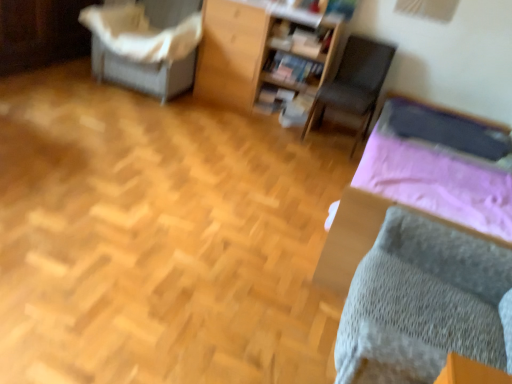
Question: Is white fabric-covered chair at upper left, which is counted as the first furniture, starting from the left, looking in the opposite direction of gray knitted bed at lower right?

Choices:
 (A) no
 (B) yes

Answer: (A)

Question: Considering the relative sizes of white fabric-covered chair at upper left, the 2th furniture in the right-to-left sequence, and gray knitted bed at lower right in the image provided, is white fabric-covered chair at upper left, the 2th furniture in the right-to-left sequence, thinner than gray knitted bed at lower right?

Choices:
 (A) no
 (B) yes

Answer: (B)

Question: Does white fabric-covered chair at upper left, which is counted as the first furniture, starting from the left, contain gray knitted bed at lower right?

Choices:
 (A) yes
 (B) no

Answer: (B)

Question: From a real-world perspective, is white fabric-covered chair at upper left, the 2th furniture in the right-to-left sequence, on gray knitted bed at lower right?

Choices:
 (A) yes
 (B) no

Answer: (A)

Question: Is white fabric-covered chair at upper left, the 2th furniture in the right-to-left sequence, beside gray knitted bed at lower right?

Choices:
 (A) yes
 (B) no

Answer: (B)

Question: Can you confirm if white fabric-covered chair at upper left, the 2th furniture in the right-to-left sequence, is positioned to the right of gray knitted bed at lower right?

Choices:
 (A) no
 (B) yes

Answer: (A)

Question: Is the depth of matte wooden bookshelf at center less than that of wooden bookshelf at upper center, arranged as the second furniture when viewed from the left?

Choices:
 (A) no
 (B) yes

Answer: (A)

Question: Is matte wooden bookshelf at center with wooden bookshelf at upper center, arranged as the second furniture when viewed from the left?

Choices:
 (A) yes
 (B) no

Answer: (B)

Question: Can you confirm if matte wooden bookshelf at center is bigger than wooden bookshelf at upper center, arranged as the second furniture when viewed from the left?

Choices:
 (A) yes
 (B) no

Answer: (B)

Question: Considering the relative positions of matte wooden bookshelf at center and wooden bookshelf at upper center, the 1th furniture from the right, in the image provided, is matte wooden bookshelf at center to the left of wooden bookshelf at upper center, the 1th furniture from the right, from the viewer's perspective?

Choices:
 (A) yes
 (B) no

Answer: (B)

Question: From a real-world perspective, is matte wooden bookshelf at center located higher than wooden bookshelf at upper center, the 1th furniture from the right?

Choices:
 (A) no
 (B) yes

Answer: (A)

Question: Is matte wooden bookshelf at center looking in the opposite direction of wooden bookshelf at upper center, the 1th furniture from the right?

Choices:
 (A) yes
 (B) no

Answer: (A)

Question: From the image's perspective, is gray knitted bed at lower right located above white fabric-covered chair at upper left, which is counted as the first furniture, starting from the left?

Choices:
 (A) no
 (B) yes

Answer: (A)